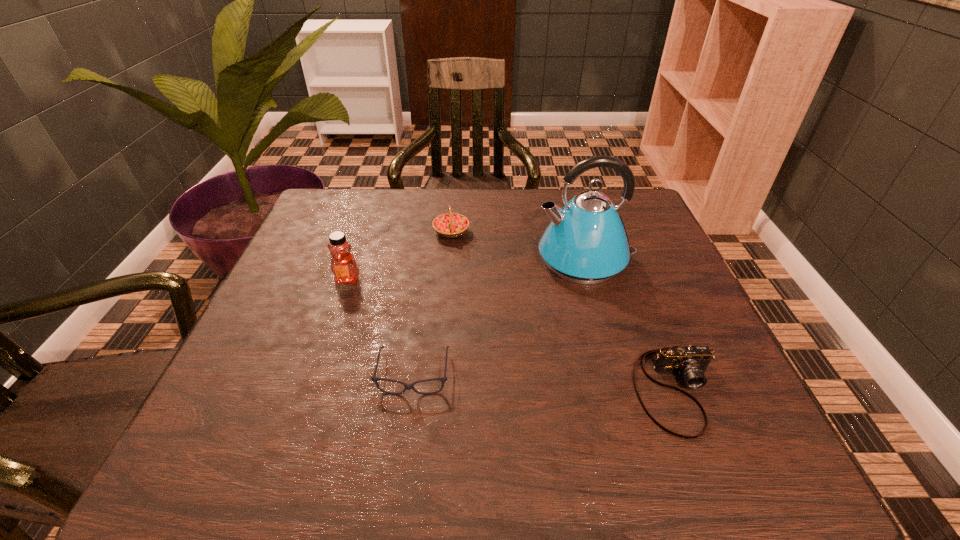
The height and width of the screenshot is (540, 960). I want to click on free space between the spectacles and the honey, so click(380, 327).

Identify the location of vacant region between the fourth tallest object and the fourth shortest object. Image resolution: width=960 pixels, height=540 pixels. (513, 335).

The width and height of the screenshot is (960, 540). Find the location of `vacant area that lies between the second tallest object and the kettle`. vacant area that lies between the second tallest object and the kettle is located at coordinates (467, 269).

Identify the location of free space between the third shortest object and the tallest object. (518, 246).

Identify the location of blank region between the third shortest object and the honey. (399, 256).

The height and width of the screenshot is (540, 960). What are the coordinates of `object that is the closest to the shortest object` in the screenshot? It's located at (343, 265).

Select which object is the second closest to the kettle. Please provide its 2D coordinates. Your answer should be formatted as a tuple, i.e. [(x, y)], where the tuple contains the x and y coordinates of a point satisfying the conditions above.

[(691, 362)]

Where is `free region that satisfies the following two spatial constraints: 1. at the spout of the kettle; 2. on the front-facing side of the spectacles`? The image size is (960, 540). free region that satisfies the following two spatial constraints: 1. at the spout of the kettle; 2. on the front-facing side of the spectacles is located at coordinates (618, 375).

This screenshot has width=960, height=540. Identify the location of free space in the image that satisfies the following two spatial constraints: 1. at the spout of the tallest object; 2. on the front label of the leftmost object. (590, 279).

The height and width of the screenshot is (540, 960). In order to click on vacant area that satisfies the following two spatial constraints: 1. at the spout of the kettle; 2. on the front-facing side of the shortest object in this screenshot , I will do `click(618, 375)`.